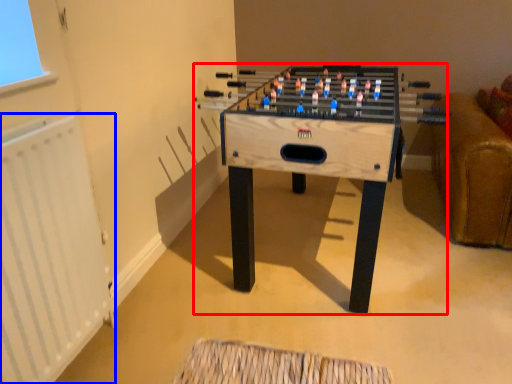
Question: Which of the following is the closest to the observer, table (highlighted by a red box) or radiator (highlighted by a blue box)?

Choices:
 (A) table
 (B) radiator

Answer: (B)